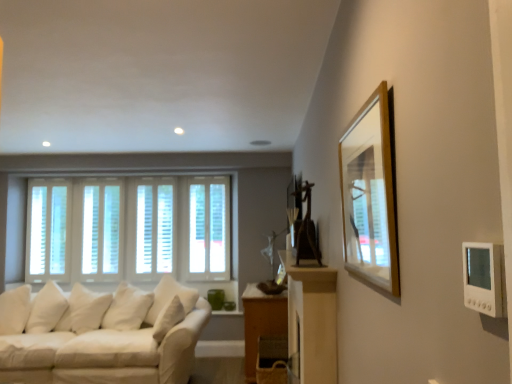
Question: Is wooden table at lower center thinner than white fabric couch at lower left?

Choices:
 (A) yes
 (B) no

Answer: (A)

Question: Is wooden table at lower center bigger than white fabric couch at lower left?

Choices:
 (A) yes
 (B) no

Answer: (B)

Question: Is wooden table at lower center at the left side of white fabric couch at lower left?

Choices:
 (A) yes
 (B) no

Answer: (B)

Question: Considering the relative sizes of wooden table at lower center and white fabric couch at lower left in the image provided, is wooden table at lower center shorter than white fabric couch at lower left?

Choices:
 (A) no
 (B) yes

Answer: (A)

Question: Does wooden table at lower center have a greater width compared to white fabric couch at lower left?

Choices:
 (A) no
 (B) yes

Answer: (A)

Question: Which is correct: white wood blinds at left, positioned as the first window in left-to-right order, is inside white wood blinds at center, marked as the second window in a right-to-left arrangement, or outside of it?

Choices:
 (A) inside
 (B) outside

Answer: (B)

Question: Based on their positions, is white wood blinds at left, which appears as the 4th window when viewed from the right, located to the left or right of white wood blinds at center, marked as the second window in a right-to-left arrangement?

Choices:
 (A) left
 (B) right

Answer: (A)

Question: Is white wood blinds at left, positioned as the first window in left-to-right order, taller or shorter than white wood blinds at center, placed as the third window when sorted from left to right?

Choices:
 (A) tall
 (B) short

Answer: (A)

Question: From a real-world perspective, is white wood blinds at left, which appears as the 4th window when viewed from the right, above or below white wood blinds at center, placed as the third window when sorted from left to right?

Choices:
 (A) above
 (B) below

Answer: (A)

Question: Would you say white wood blinds at left, which appears as the 4th window when viewed from the right, is to the left or to the right of wooden frame at upper right in the picture?

Choices:
 (A) left
 (B) right

Answer: (A)

Question: From the image's perspective, is white wood blinds at left, positioned as the first window in left-to-right order, positioned above or below wooden frame at upper right?

Choices:
 (A) below
 (B) above

Answer: (A)

Question: Does point (37, 248) appear closer or farther from the camera than point (382, 198)?

Choices:
 (A) closer
 (B) farther

Answer: (B)

Question: Choose the correct answer: Is white wood blinds at left, which appears as the 4th window when viewed from the right, inside wooden frame at upper right or outside it?

Choices:
 (A) outside
 (B) inside

Answer: (A)

Question: Considering the positions of white wood blinds at center, positioned as the first window in right-to-left order, and wooden frame at upper right in the image, is white wood blinds at center, positioned as the first window in right-to-left order, wider or thinner than wooden frame at upper right?

Choices:
 (A) thin
 (B) wide

Answer: (B)

Question: Considering their positions, is white wood blinds at center, positioned as the first window in right-to-left order, located in front of or behind wooden frame at upper right?

Choices:
 (A) front
 (B) behind

Answer: (B)